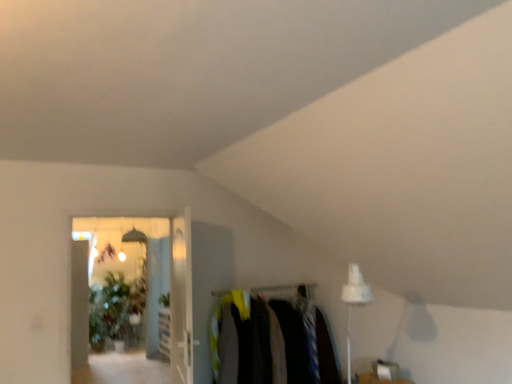
Question: Is transparent glass door at center, acting as the 2th glass door starting from the right, to the left or to the right of dark fabric clothes at center in the image?

Choices:
 (A) left
 (B) right

Answer: (A)

Question: From their relative heights in the image, would you say transparent glass door at center, acting as the first glass door starting from the left, is taller or shorter than dark fabric clothes at center?

Choices:
 (A) short
 (B) tall

Answer: (B)

Question: Based on their relative distances, which object is nearer to the clear glass door at center, which ranks as the first glass door in right-to-left order?

Choices:
 (A) green leafy plant at upper center
 (B) dark fabric clothes at center
 (C) transparent glass door at center, acting as the first glass door starting from the left

Answer: (B)

Question: Which is farther from the clear glass door at center, the second glass door from the left?

Choices:
 (A) green leafy plant at upper center
 (B) transparent glass door at center, acting as the 2th glass door starting from the right
 (C) dark fabric clothes at center

Answer: (B)